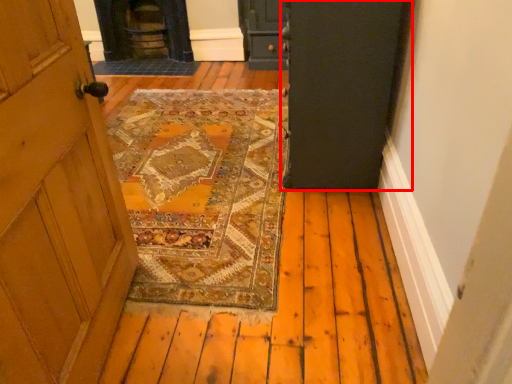
Question: From the image, what is the correct spatial relationship of door (annotated by the red box) in relation to stove?

Choices:
 (A) right
 (B) left

Answer: (A)